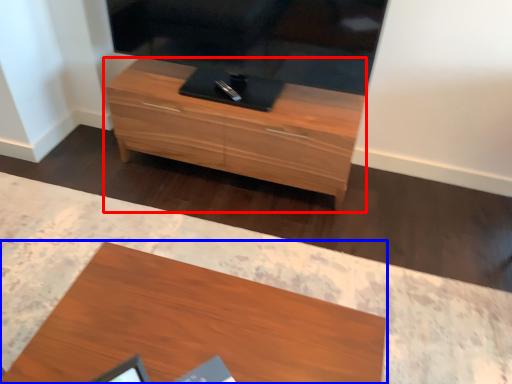
Question: Which object is closer to the camera taking this photo, chest of drawers (highlighted by a red box) or desk (highlighted by a blue box)?

Choices:
 (A) chest of drawers
 (B) desk

Answer: (B)